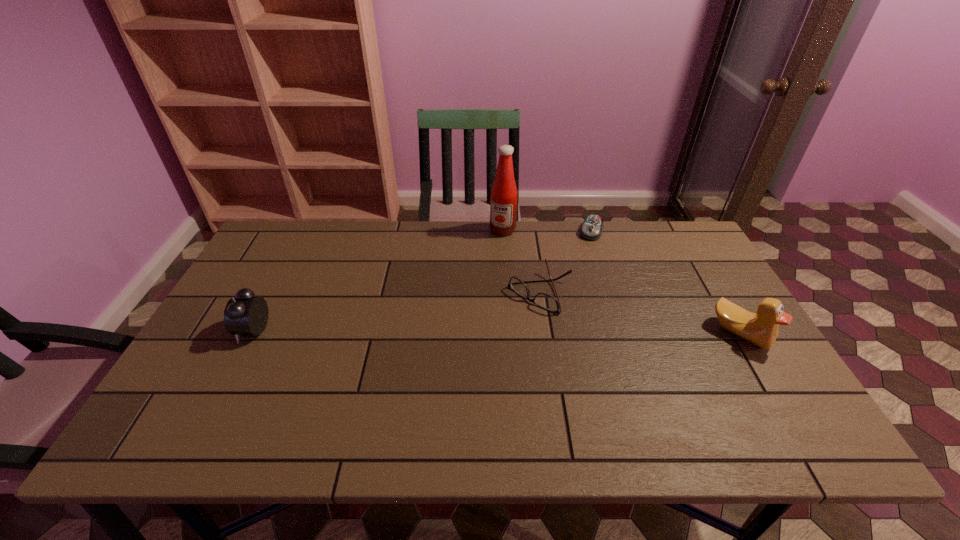
At what (x,y) coordinates should I click in order to perform the action: click on alarm clock. Please return your answer as a coordinate pair (x, y). Looking at the image, I should click on (244, 314).

Locate an element on the screen. duck is located at coordinates (761, 328).

Locate an element on the screen. The image size is (960, 540). condiment is located at coordinates (503, 207).

Where is `the shortest object`? the shortest object is located at coordinates (592, 227).

Identify the location of the second object from right to left. (592, 227).

Where is `spectacles`? spectacles is located at coordinates (548, 302).

I want to click on vacant space situated 0.070m on the front side of the alarm clock, so click(215, 329).

Identify the location of vacant space located at the beak of the rightmost object. The image size is (960, 540). (778, 395).

What are the coordinates of `vacant space located on the front-facing side of the condiment` in the screenshot? It's located at (459, 311).

Image resolution: width=960 pixels, height=540 pixels. I want to click on vacant space located on the front-facing side of the condiment, so click(x=468, y=295).